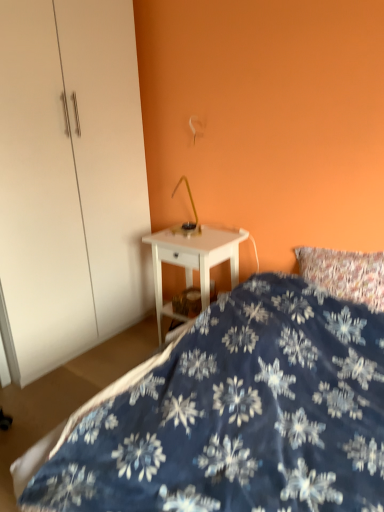
Question: Should I look upward or downward to see white glossy dresser at center?

Choices:
 (A) up
 (B) down

Answer: (A)

Question: Is white glossy nightstand at center bigger than white glossy dresser at center?

Choices:
 (A) no
 (B) yes

Answer: (A)

Question: Can you confirm if white glossy nightstand at center is wider than white glossy dresser at center?

Choices:
 (A) no
 (B) yes

Answer: (A)

Question: From the image's perspective, is white glossy nightstand at center under white glossy dresser at center?

Choices:
 (A) no
 (B) yes

Answer: (B)

Question: Is white glossy nightstand at center placed right next to white glossy dresser at center?

Choices:
 (A) no
 (B) yes

Answer: (A)

Question: Is white glossy nightstand at center taller than white glossy dresser at center?

Choices:
 (A) yes
 (B) no

Answer: (B)

Question: Is white glossy nightstand at center facing away from white glossy dresser at center?

Choices:
 (A) yes
 (B) no

Answer: (B)

Question: Does blue fabric bed at lower right turn towards white glossy nightstand at center?

Choices:
 (A) no
 (B) yes

Answer: (A)

Question: Can you confirm if blue fabric bed at lower right is thinner than white glossy nightstand at center?

Choices:
 (A) no
 (B) yes

Answer: (A)

Question: Is blue fabric bed at lower right outside of white glossy nightstand at center?

Choices:
 (A) yes
 (B) no

Answer: (A)

Question: From the image's perspective, is blue fabric bed at lower right over white glossy nightstand at center?

Choices:
 (A) no
 (B) yes

Answer: (A)

Question: Considering the relative sizes of blue fabric bed at lower right and white glossy nightstand at center in the image provided, is blue fabric bed at lower right wider than white glossy nightstand at center?

Choices:
 (A) no
 (B) yes

Answer: (B)

Question: From the image's perspective, is blue fabric bed at lower right located beneath white glossy nightstand at center?

Choices:
 (A) yes
 (B) no

Answer: (A)

Question: From the image's perspective, is white glossy dresser at center above blue fabric bed at lower right?

Choices:
 (A) yes
 (B) no

Answer: (A)